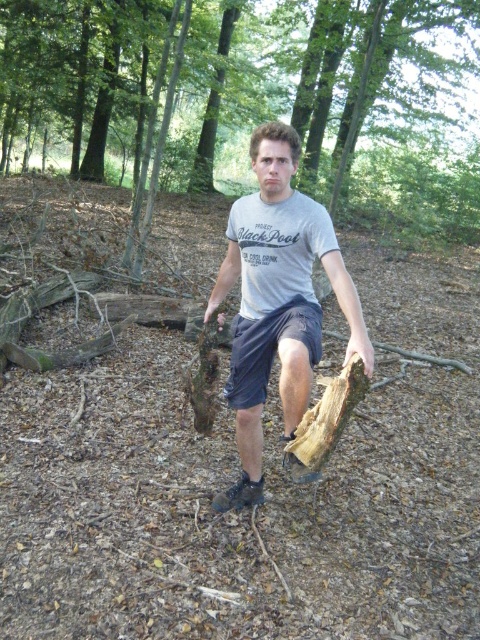
Question: Observing the image, what is the correct spatial positioning of rough bark tree at center in reference to matte gray t-shirt at center?

Choices:
 (A) above
 (B) below

Answer: (A)

Question: Is rough bark tree at center smaller than dark blue cotton shorts at center?

Choices:
 (A) yes
 (B) no

Answer: (B)

Question: Which point appears closest to the camera in this image?

Choices:
 (A) (247, 262)
 (B) (312, 317)

Answer: (B)

Question: Which object appears farthest from the camera in this image?

Choices:
 (A) dark blue cotton shorts at center
 (B) matte gray t-shirt at center

Answer: (A)

Question: Does rough bark tree at center have a greater width compared to dark blue cotton shorts at center?

Choices:
 (A) yes
 (B) no

Answer: (A)

Question: Which object is positioned closest to the matte gray t-shirt at center?

Choices:
 (A) rough bark tree at center
 (B) dark blue cotton shorts at center

Answer: (B)